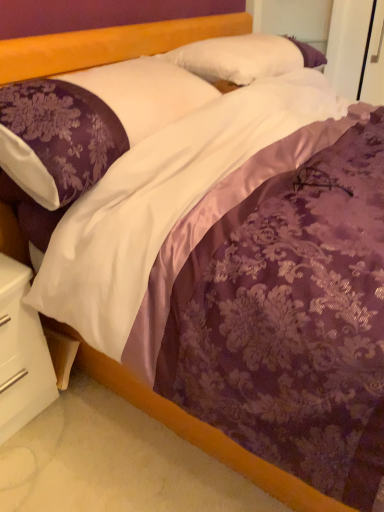
Question: Is the position of white glossy nightstand at lower left more distant than that of purple satin pillow at upper left, which is the 2th pillow from back to front?

Choices:
 (A) yes
 (B) no

Answer: (A)

Question: Is white glossy nightstand at lower left closer to camera compared to purple satin pillow at upper left, which is the 2th pillow from back to front?

Choices:
 (A) no
 (B) yes

Answer: (A)

Question: Is purple satin pillow at upper left, positioned as the 1th pillow in front-to-back order, at the back of white glossy nightstand at lower left?

Choices:
 (A) no
 (B) yes

Answer: (A)

Question: Can you confirm if white glossy nightstand at lower left is smaller than purple satin pillow at upper left, positioned as the 1th pillow in front-to-back order?

Choices:
 (A) no
 (B) yes

Answer: (B)

Question: Is purple satin pillow at upper left, positioned as the 1th pillow in front-to-back order, surrounded by white glossy nightstand at lower left?

Choices:
 (A) yes
 (B) no

Answer: (B)

Question: From the image's perspective, is white glossy nightstand at lower left located above purple satin pillow at upper left, positioned as the 1th pillow in front-to-back order?

Choices:
 (A) no
 (B) yes

Answer: (A)

Question: From the image's perspective, is purple satin pillow at upper left, positioned as the 1th pillow in front-to-back order, over white glossy nightstand at lower left?

Choices:
 (A) no
 (B) yes

Answer: (B)

Question: Is purple satin pillow at upper left, positioned as the 1th pillow in front-to-back order, surrounding white glossy nightstand at lower left?

Choices:
 (A) no
 (B) yes

Answer: (A)

Question: Can you see purple satin pillow at upper left, which is the 2th pillow from back to front, touching white glossy nightstand at lower left?

Choices:
 (A) yes
 (B) no

Answer: (B)

Question: Is purple satin pillow at upper left, which is the 2th pillow from back to front, bigger than white glossy nightstand at lower left?

Choices:
 (A) yes
 (B) no

Answer: (A)

Question: Is purple satin pillow at upper left, positioned as the 1th pillow in front-to-back order, not within white glossy nightstand at lower left?

Choices:
 (A) yes
 (B) no

Answer: (A)

Question: Is purple satin pillow at upper left, positioned as the 1th pillow in front-to-back order, positioned behind white glossy nightstand at lower left?

Choices:
 (A) yes
 (B) no

Answer: (B)

Question: Is white satin pillow at upper center, marked as the second pillow in a front-to-back arrangement, positioned with its back to white glossy nightstand at lower left?

Choices:
 (A) no
 (B) yes

Answer: (A)